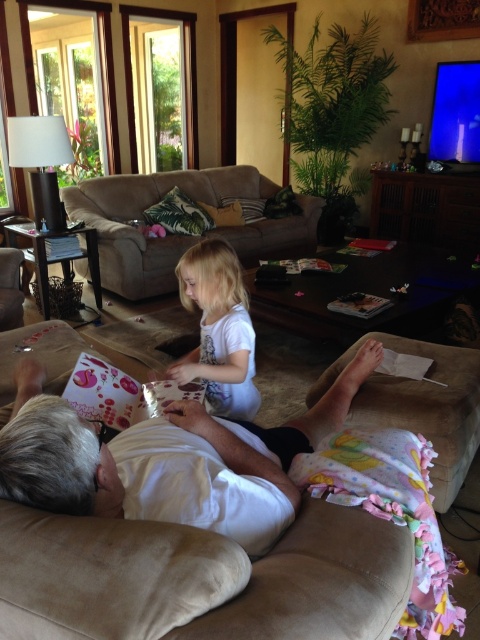
Is brown fabric pillow at center bigger than velvet floral pillow at center?

Incorrect, brown fabric pillow at center is not larger than velvet floral pillow at center.

Which of these two, brown fabric pillow at center or velvet floral pillow at center, stands shorter?

brown fabric pillow at center is shorter.

Which is behind, point (230, 224) or point (241, 205)?

Point (241, 205)

Find the location of a particular element. This screenshot has width=480, height=640. brown fabric pillow at center is located at coordinates (225, 212).

Does point (243, 332) come in front of point (253, 212)?

Yes, it is in front of point (253, 212).

Is white matte shirt at center further to camera compared to velvet floral pillow at center?

No, it is not.

Where is `white matte shirt at center`? This screenshot has height=640, width=480. white matte shirt at center is located at coordinates (218, 330).

Which of these two, tropical print fabric pillow at center or brown fabric pillow at center, stands taller?

With more height is tropical print fabric pillow at center.

In the scene shown: Does tropical print fabric pillow at center have a lesser height compared to brown fabric pillow at center?

Incorrect, tropical print fabric pillow at center's height does not fall short of brown fabric pillow at center's.

Is point (212, 218) more distant than point (208, 212)?

That is False.

Where is `tropical print fabric pillow at center`? The image size is (480, 640). tropical print fabric pillow at center is located at coordinates (179, 214).